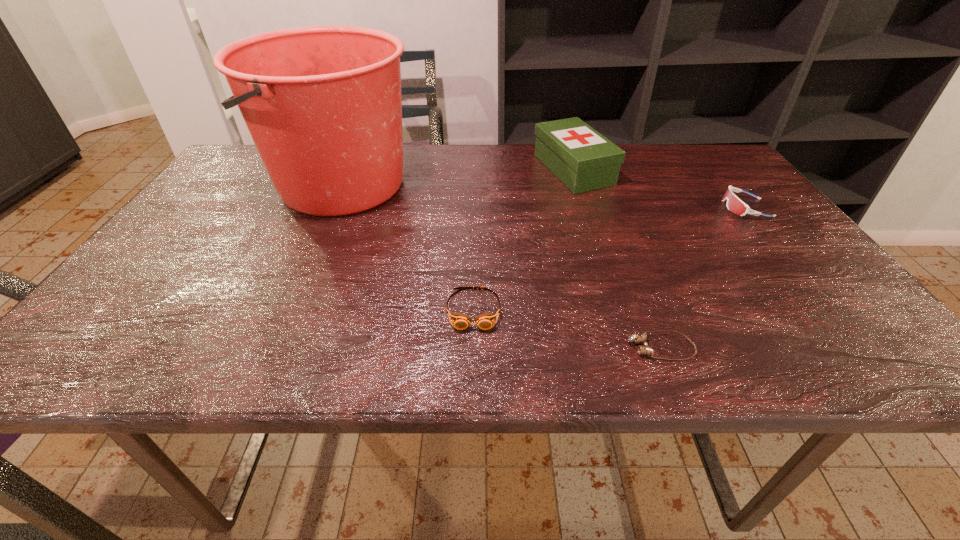
The height and width of the screenshot is (540, 960). I want to click on object situated at the right edge, so click(734, 204).

You are a GUI agent. You are given a task and a screenshot of the screen. Output one action in this format:
    pyautogui.click(x=<x>, y=<y>)
    Task: Click on the object situated at the far left corner
    
    Given the screenshot: What is the action you would take?
    pyautogui.click(x=323, y=105)

In the image, there is a desktop. Where is `vacant space at the far edge`? vacant space at the far edge is located at coordinates (652, 172).

This screenshot has width=960, height=540. I want to click on free spot at the near edge of the desktop, so click(555, 355).

Where is `vacant space at the left edge`? This screenshot has width=960, height=540. vacant space at the left edge is located at coordinates (188, 262).

The width and height of the screenshot is (960, 540). Identify the location of vacant space at the right edge. (772, 227).

Where is `vacant region at the far left corner of the desktop`? The width and height of the screenshot is (960, 540). vacant region at the far left corner of the desktop is located at coordinates (240, 172).

Locate an element on the screen. This screenshot has height=540, width=960. free space at the far right corner is located at coordinates (678, 166).

Locate an element on the screen. vacant space at the near right corner of the desktop is located at coordinates (825, 329).

At what (x,y) coordinates should I click in order to perform the action: click on free point between the tallest goggles and the shortest goggles. Please return your answer as a coordinate pair (x, y). The width and height of the screenshot is (960, 540). Looking at the image, I should click on (703, 278).